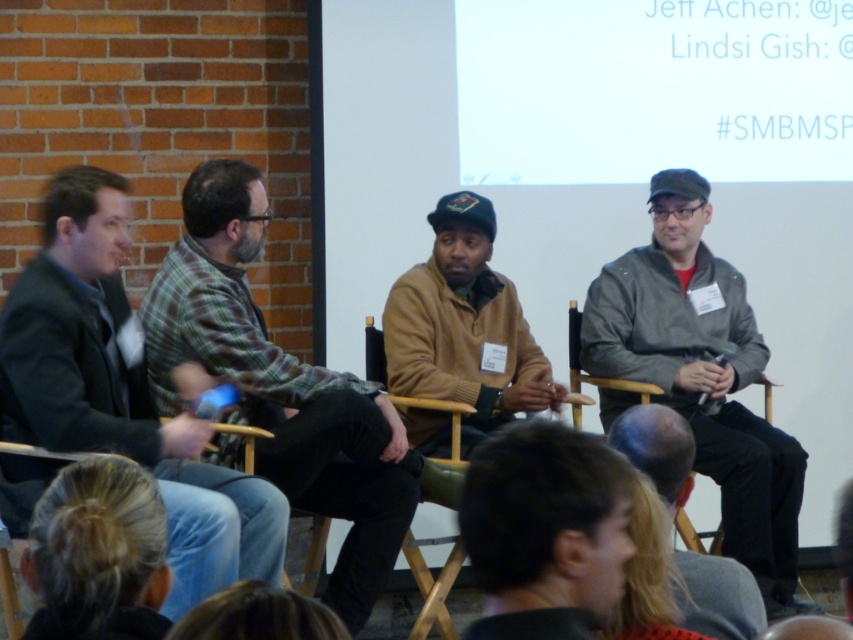
What color is the jacket worn by the person seated at the position corresponding to the coordinates point (123, 392) in the image?

The jacket at point (123, 392) is dark gray.

You are attending a panel discussion and notice two presenters wearing the plaid fabric shirt at center and the matte brown sweater at center. From your perspective, which one is positioned to the left?

The plaid fabric shirt at center is to the left of the matte brown sweater at center.